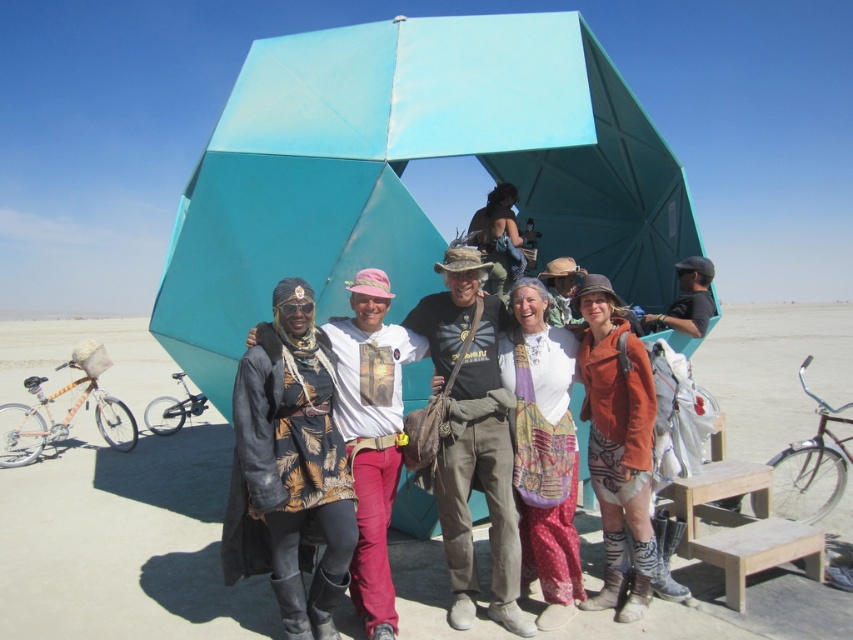
You are a photographer trying to capture a photo of the teal fabric tent at center and dark blue fabric hat at center. Which object should you focus on first if you want to include both in your frame without moving the camera?

The teal fabric tent at center is positioned on the left side of dark blue fabric hat at center, so you should focus on the teal fabric tent at center first to ensure both are in frame.

You are standing in front of the geodesic dome and want to walk towards the two points marked in the image. Which point, point (741,605) or point (611,481), will you reach first?

Point (741,605) is closer to the viewer than point (611,481), so you will reach point (741,605) first.

You are a photographer trying to capture the leather jacket at center and the printed cotton skirt at center in the same frame. Which item should you focus on first if you want to ensure both are in focus?

The printed cotton skirt at center should be focused on first because the leather jacket at center is above it, so adjusting focus starting from the lower object ensures both are in the frame.